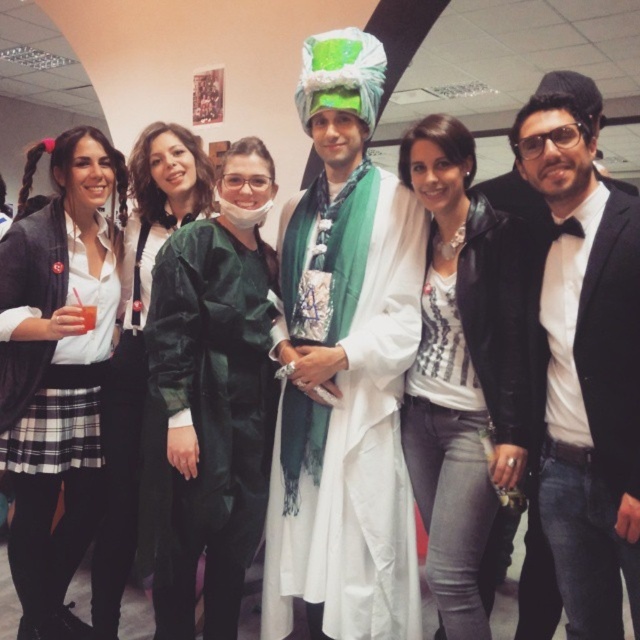
Question: Is matte white coat at center in front of matte green coat at center?

Choices:
 (A) no
 (B) yes

Answer: (B)

Question: Is black satin bow tie at right below white textured shirt at center?

Choices:
 (A) no
 (B) yes

Answer: (A)

Question: Which object is the farthest from the matte green coat at center?

Choices:
 (A) black satin bow tie at right
 (B) white matte shirt at upper left
 (C) white textured shirt at center

Answer: (A)

Question: Which of the following is the farthest from the observer?

Choices:
 (A) matte white coat at center
 (B) matte green coat at center

Answer: (B)

Question: Which object is the farthest from the black satin bow tie at right?

Choices:
 (A) matte white coat at center
 (B) matte green coat at center

Answer: (B)

Question: Can you confirm if matte white coat at center is smaller than green fabric coat at center?

Choices:
 (A) no
 (B) yes

Answer: (A)